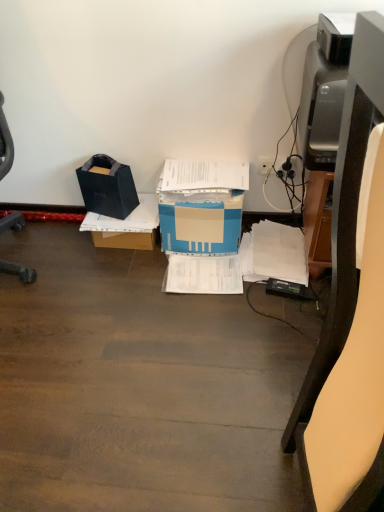
Question: From a real-world perspective, relative to matte black printer at right, is blue cardboard box at center, the 1th box in the right-to-left sequence, vertically above or below?

Choices:
 (A) above
 (B) below

Answer: (B)

Question: From their relative heights in the image, would you say blue cardboard box at center, placed as the second box when sorted from left to right, is taller or shorter than matte black printer at right?

Choices:
 (A) short
 (B) tall

Answer: (A)

Question: Which object is the closest to the white paper at center, which is the first document from left to right?

Choices:
 (A) matte black printer at right
 (B) black matte bag at left, marked as the 2th box in a right-to-left arrangement
 (C) blue cardboard box at center, placed as the second box when sorted from left to right
 (D) white plastic plug at upper right
 (E) white paper at lower right, acting as the 2th document starting from the left

Answer: (C)

Question: Which is farther from the matte black printer at right?

Choices:
 (A) white plastic plug at upper right
 (B) blue cardboard box at center, placed as the second box when sorted from left to right
 (C) black matte bag at left, which is counted as the first box, starting from the left
 (D) white paper at lower right, marked as the first document in a right-to-left arrangement
 (E) white paper at center, which is the first document from left to right

Answer: (C)